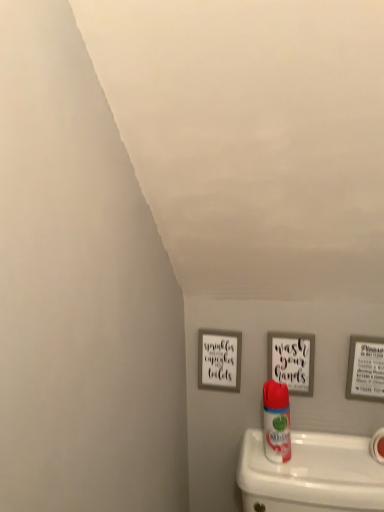
Question: Considering the relative sizes of white matte toilet paper at lower right and wooden sign at center, which is the second picture frame from left to right, in the image provided, is white matte toilet paper at lower right thinner than wooden sign at center, which is the second picture frame from left to right,?

Choices:
 (A) yes
 (B) no

Answer: (B)

Question: Does white matte toilet paper at lower right have a greater width compared to wooden sign at center, acting as the second picture frame starting from the right?

Choices:
 (A) yes
 (B) no

Answer: (A)

Question: Is white matte toilet paper at lower right facing away from wooden sign at center, which is the second picture frame from left to right?

Choices:
 (A) no
 (B) yes

Answer: (A)

Question: Can you see white matte toilet paper at lower right touching wooden sign at center, which is the second picture frame from left to right?

Choices:
 (A) no
 (B) yes

Answer: (A)

Question: Could wooden sign at center, acting as the second picture frame starting from the right, be considered to be inside white matte toilet paper at lower right?

Choices:
 (A) yes
 (B) no

Answer: (B)

Question: Can you confirm if white matte toilet paper at lower right is bigger than wooden sign at center, acting as the second picture frame starting from the right?

Choices:
 (A) no
 (B) yes

Answer: (A)

Question: Does matte gray picture frame at center, which ranks as the third picture frame in right-to-left order, have a lesser height compared to matte gray picture frame at right, which is counted as the 1th picture frame, starting from the right?

Choices:
 (A) no
 (B) yes

Answer: (A)

Question: Is matte gray picture frame at center, the first picture frame from the left, next to matte gray picture frame at right, which ranks as the 3th picture frame in left-to-right order, and touching it?

Choices:
 (A) no
 (B) yes

Answer: (A)

Question: Can you confirm if matte gray picture frame at center, the first picture frame from the left, is wider than matte gray picture frame at right, which ranks as the 3th picture frame in left-to-right order?

Choices:
 (A) no
 (B) yes

Answer: (A)

Question: Is matte gray picture frame at center, which ranks as the third picture frame in right-to-left order, turned away from matte gray picture frame at right, which ranks as the 3th picture frame in left-to-right order?

Choices:
 (A) no
 (B) yes

Answer: (A)

Question: Is matte gray picture frame at center, the first picture frame from the left, positioned in front of matte gray picture frame at right, which is counted as the 1th picture frame, starting from the right?

Choices:
 (A) yes
 (B) no

Answer: (B)

Question: Is matte gray picture frame at center, the first picture frame from the left, bigger than matte gray picture frame at right, which is counted as the 1th picture frame, starting from the right?

Choices:
 (A) yes
 (B) no

Answer: (B)

Question: Is wooden sign at center, acting as the second picture frame starting from the right, shorter than white glossy air freshener at center?

Choices:
 (A) no
 (B) yes

Answer: (B)